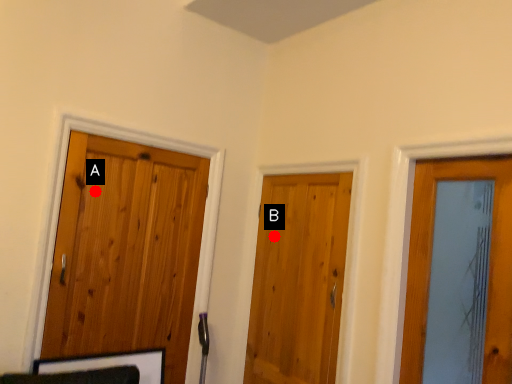
Question: Two points are circled on the image, labeled by A and B beside each circle. Which of the following is the farthest from the observer?

Choices:
 (A) A is further
 (B) B is further

Answer: (B)